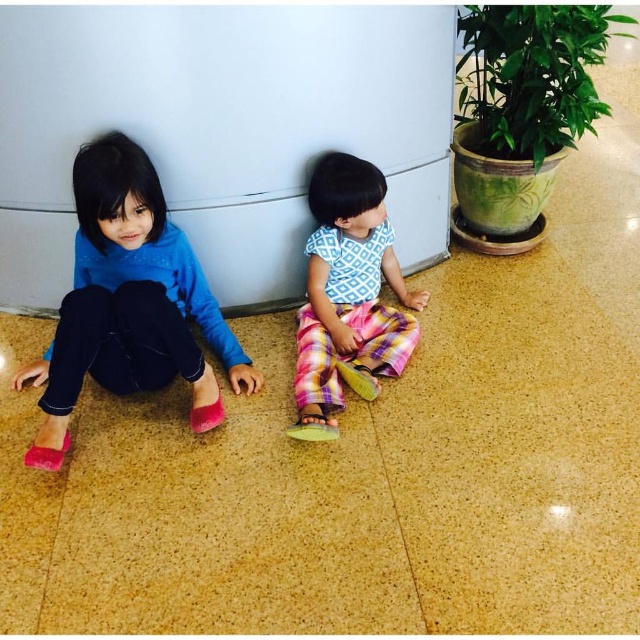
Does matte pink shoes at left appear on the left side of plaid fabric pants at center?

Yes, matte pink shoes at left is to the left of plaid fabric pants at center.

Does point (128, 176) come farther from viewer compared to point (330, 176)?

No, it is not.

Which is in front, point (193, 276) or point (323, 371)?

Positioned in front is point (323, 371).

Where is `matte pink shoes at left`? matte pink shoes at left is located at coordinates (129, 301).